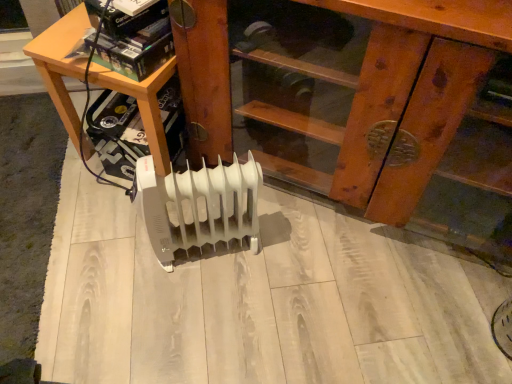
Find the location of `white plastic heater at center`. white plastic heater at center is located at coordinates (199, 206).

This screenshot has width=512, height=384. Find the location of `white plastic heater at center`. white plastic heater at center is located at coordinates (360, 100).

Between wooden at left and white plastic heater at center, which one has smaller width?

With smaller width is white plastic heater at center.

You are a GUI agent. You are given a task and a screenshot of the screen. Output one action in this format:
    pyautogui.click(x=<x>, y=<y>)
    Task: Click on the table behind the white plastic heater at center
    The width and height of the screenshot is (512, 384).
    Given the screenshot: What is the action you would take?
    pyautogui.click(x=61, y=64)

Can you confirm if wooden at left is bigger than white plastic heater at center?

Indeed, wooden at left has a larger size compared to white plastic heater at center.

From the image's perspective, which object appears higher, wooden at left or white plastic heater at center?

wooden at left, from the image's perspective.

In terms of width, does wooden at left look wider or thinner when compared to white plastic heater at center?

In the image, wooden at left appears to be more narrow than white plastic heater at center.

In the scene shown: Considering the relative sizes of wooden at left and white plastic heater at center in the image provided, is wooden at left taller than white plastic heater at center?

No.

Which is correct: wooden at left is inside white plastic heater at center, or outside of it?

wooden at left is not enclosed by white plastic heater at center.

From the picture: From a real-world perspective, does wooden at left sit lower than white plastic heater at center?

Indeed, from a real-world perspective, wooden at left is positioned beneath white plastic heater at center.

Considering the positions of points (252, 252) and (158, 141), is point (252, 252) closer to camera compared to point (158, 141)?

No.

From the image's perspective, which is below, white plastic heater at center or wooden at left?

white plastic heater at center appears lower in the image.

Is white plastic heater at center beside wooden at left?

white plastic heater at center is not next to wooden at left, and they're not touching.

From a real-world perspective, which is physically below, white plastic heater at center or wooden at left?

white plastic heater at center is physically lower.

Is white plastic heater at center oriented away from white plastic heater at center?

That's not correct — white plastic heater at center is not looking away from white plastic heater at center.

Considering the relative sizes of white plastic heater at center and white plastic heater at center in the image provided, is white plastic heater at center thinner than white plastic heater at center?

Incorrect, the width of white plastic heater at center is not less than that of white plastic heater at center.

Who is taller, white plastic heater at center or white plastic heater at center?

white plastic heater at center.

From the image's perspective, is white plastic heater at center beneath white plastic heater at center?

No.

Is white plastic heater at center not within white plastic heater at center?

Yes, white plastic heater at center is located beyond the bounds of white plastic heater at center.

Between white plastic heater at center and white plastic heater at center, which one has smaller size?

Smaller between the two is white plastic heater at center.

In terms of height, does white plastic heater at center look taller or shorter compared to white plastic heater at center?

In the image, white plastic heater at center appears to be shorter than white plastic heater at center.

I want to click on table that is behind the white plastic heater at center, so click(x=61, y=64).

Which is more distant, (351, 146) or (62, 51)?

The point (62, 51) is behind.

Considering the relative sizes of white plastic heater at center and wooden at left in the image provided, is white plastic heater at center thinner than wooden at left?

In fact, white plastic heater at center might be wider than wooden at left.

Image resolution: width=512 pixels, height=384 pixels. Identify the location of heater below the wooden at left (from the image's perspective). (199, 206).

At what (x,y) coordinates should I click in order to perform the action: click on table that appears above the white plastic heater at center (from the image's perspective). Please return your answer as a coordinate pair (x, y). The height and width of the screenshot is (384, 512). Looking at the image, I should click on (61, 64).

Looking at this image, considering their positions, is white plastic heater at center positioned further to wooden at left than white plastic heater at center?

white plastic heater at center.

Which object lies further to the anchor point white plastic heater at center, white plastic heater at center or wooden at left?

The object further to white plastic heater at center is white plastic heater at center.

Considering their positions, is wooden at left positioned further to white plastic heater at center than white plastic heater at center?

Based on the image, white plastic heater at center appears to be further to white plastic heater at center.

From the image, which object appears to be nearer to white plastic heater at center, wooden at left or white plastic heater at center?

wooden at left lies closer to white plastic heater at center than the other object.

From the image, which object appears to be nearer to white plastic heater at center, white plastic heater at center or wooden at left?

wooden at left is closer to white plastic heater at center.

Estimate the real-world distances between objects in this image. Which object is further from wooden at left, white plastic heater at center or white plastic heater at center?

white plastic heater at center lies further to wooden at left than the other object.

Identify the location of heater between wooden at left and white plastic heater at center. (199, 206).